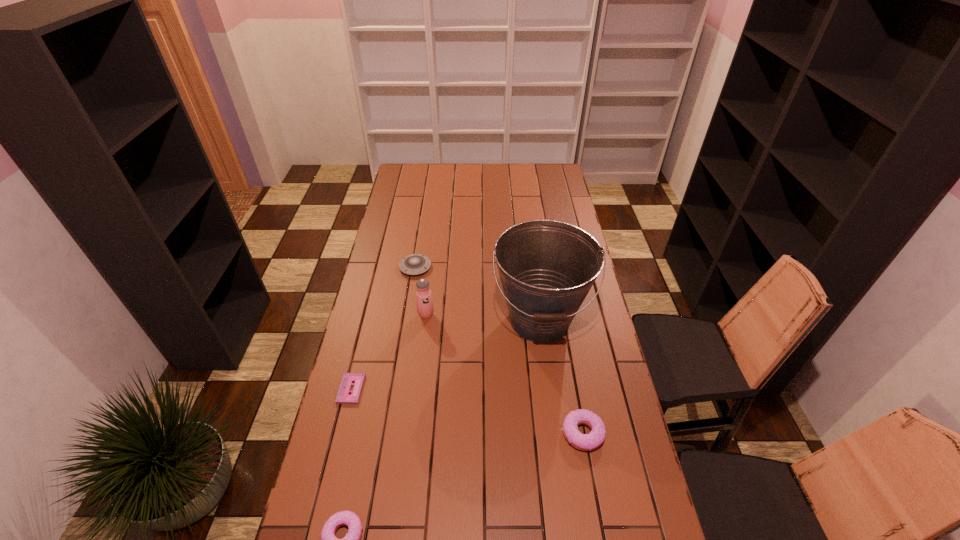
At what (x,y) coordinates should I click in order to perform the action: click on free space between the tallest object and the fifth farthest object. Please return your answer as a coordinate pair (x, y). Looking at the image, I should click on (561, 377).

You are a GUI agent. You are given a task and a screenshot of the screen. Output one action in this format:
    pyautogui.click(x=<x>, y=<y>)
    Task: Click on the vacant space that is in between the bucket and the fifth shortest object
    
    Given the screenshot: What is the action you would take?
    pyautogui.click(x=483, y=318)

This screenshot has height=540, width=960. What are the coordinates of `free space between the fourth farthest object and the fourth shortest object` in the screenshot? It's located at (467, 411).

The image size is (960, 540). I want to click on free point between the third nearest object and the right doughnut, so click(467, 411).

At what (x,y) coordinates should I click in order to perform the action: click on vacant area that lies between the right doughnut and the tallest object. Please return your answer as a coordinate pair (x, y). The width and height of the screenshot is (960, 540). Looking at the image, I should click on (561, 377).

This screenshot has height=540, width=960. I want to click on free space between the taller doughnut and the second tallest object, so click(504, 374).

In order to click on the closest object to the saucer in this screenshot , I will do `click(424, 301)`.

Locate which object is the fourth closest to the saucer. Please provide its 2D coordinates. Your answer should be formatted as a tuple, i.e. [(x, y)], where the tuple contains the x and y coordinates of a point satisfying the conditions above.

[(586, 442)]

Locate an element on the screen. blank area in the image that satisfies the following two spatial constraints: 1. with the handle on opposite sides of the bucket; 2. on the left side of the right doughnut is located at coordinates (555, 433).

I want to click on blank space that satisfies the following two spatial constraints: 1. on the front side of the saucer; 2. on the right side of the thermos bottle, so click(x=407, y=315).